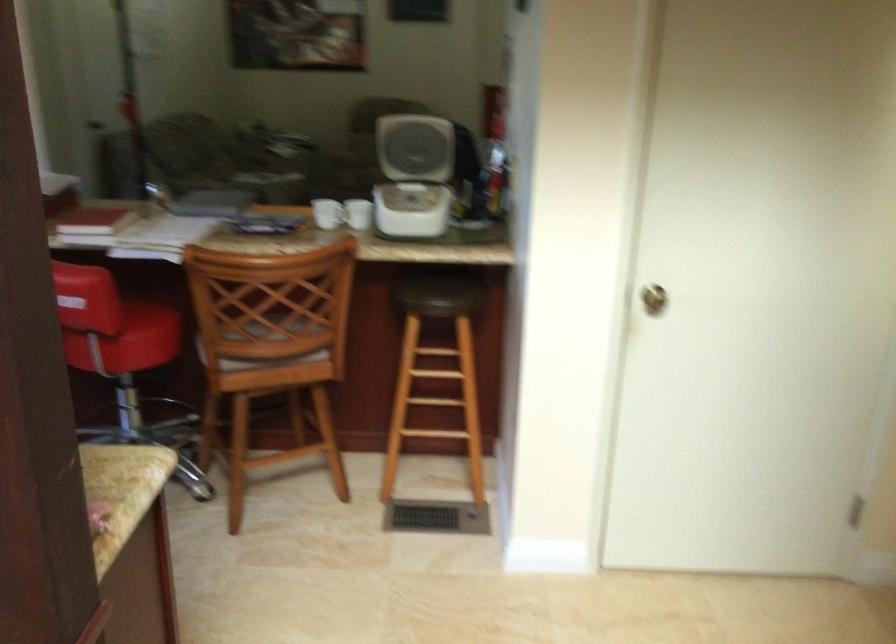
Where is `red book`? The image size is (896, 644). red book is located at coordinates (93, 223).